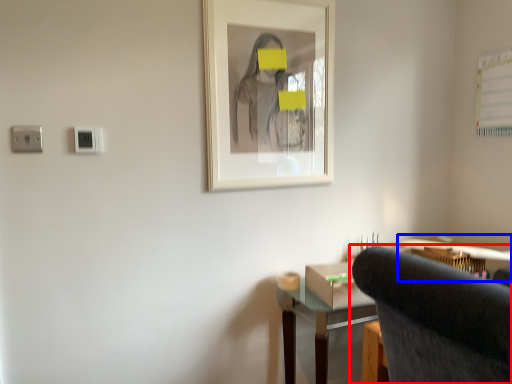
Question: Which object appears farthest to the camera in this image, chair (highlighted by a red box) or computer desk (highlighted by a blue box)?

Choices:
 (A) chair
 (B) computer desk

Answer: (B)